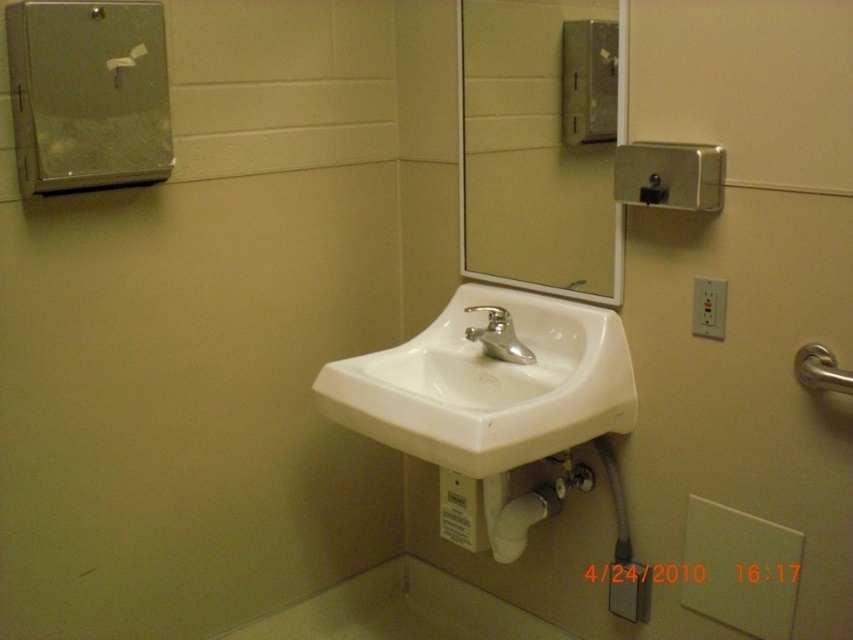
Question: Which of these objects is positioned farthest from the metallic silver hand dryer at upper left?

Choices:
 (A) clear glass mirror at upper center
 (B) satin nickel soap dispenser at upper center

Answer: (B)

Question: Is clear glass mirror at upper center bigger than satin nickel faucet at center?

Choices:
 (A) no
 (B) yes

Answer: (B)

Question: Does white ceramic sink at center appear over satin nickel soap dispenser at upper center?

Choices:
 (A) yes
 (B) no

Answer: (B)

Question: Is satin nickel faucet at center positioned at the back of silver metallic faucet at center?

Choices:
 (A) yes
 (B) no

Answer: (B)

Question: Which object is farther from the camera taking this photo?

Choices:
 (A) satin nickel soap dispenser at upper center
 (B) satin nickel faucet at center

Answer: (B)

Question: Which point is farther to the camera?

Choices:
 (A) (x=498, y=348)
 (B) (x=550, y=88)
 (C) (x=592, y=76)
 (D) (x=573, y=289)

Answer: (D)